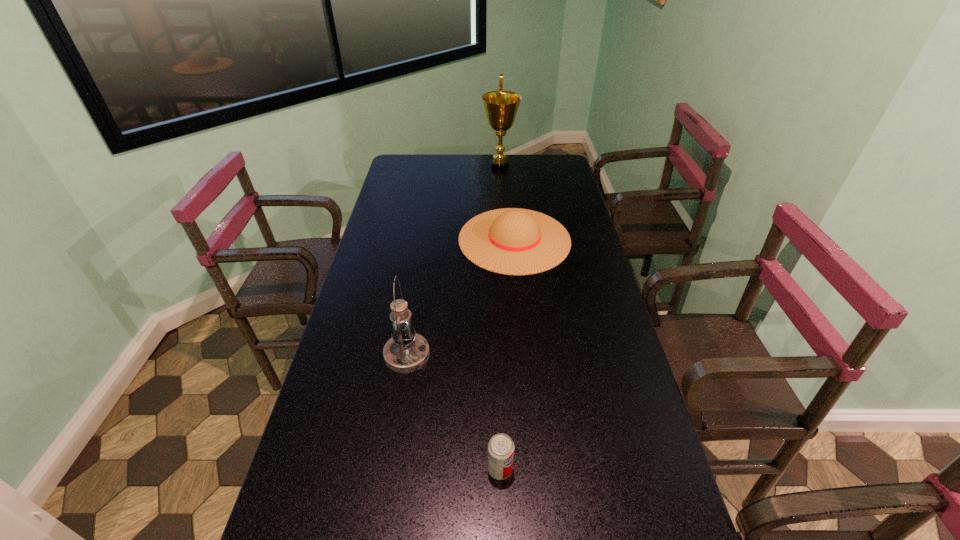
Find the location of a particular element. object that stands as the second closest to the oil lamp is located at coordinates (500, 447).

Find the location of a particular element. Image resolution: width=960 pixels, height=540 pixels. vacant space that satisfies the following two spatial constraints: 1. on the front view with handles of the award; 2. on the back side of the second farthest object is located at coordinates (505, 240).

Locate an element on the screen. The height and width of the screenshot is (540, 960). vacant region that satisfies the following two spatial constraints: 1. on the back side of the soda; 2. on the right side of the third nearest object is located at coordinates (492, 240).

The width and height of the screenshot is (960, 540). I want to click on vacant region that satisfies the following two spatial constraints: 1. on the front view with handles of the third nearest object; 2. on the left side of the award, so click(x=505, y=240).